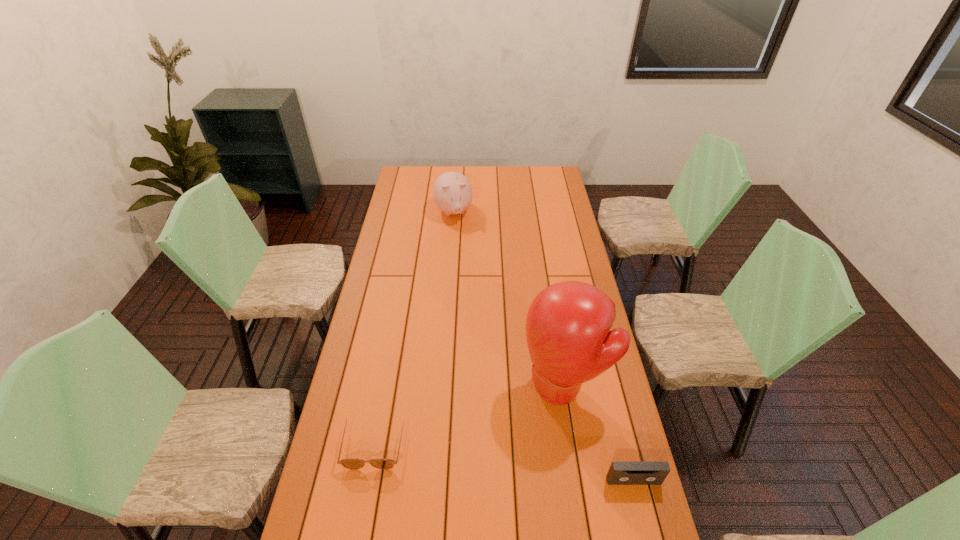
This screenshot has height=540, width=960. Identify the location of vacant space that's between the piggy bank and the shortest object. (414, 327).

Find the location of a particular element. Image resolution: width=960 pixels, height=540 pixels. object identified as the closest to the nearest object is located at coordinates (568, 324).

Select which object is the third closest to the sunglasses. Please provide its 2D coordinates. Your answer should be formatted as a tuple, i.e. [(x, y)], where the tuple contains the x and y coordinates of a point satisfying the conditions above.

[(452, 191)]